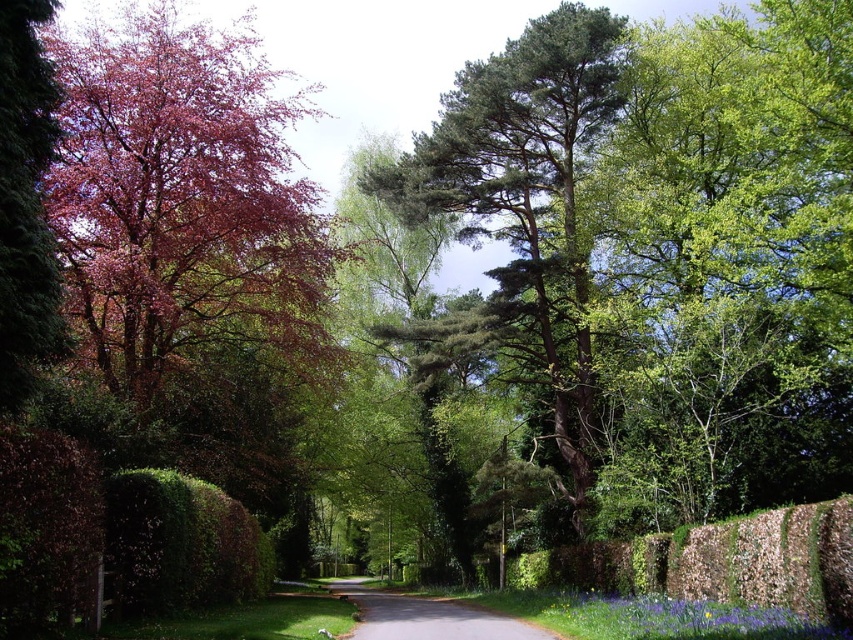
Who is more distant from viewer, (219, 588) or (476, 608)?

Positioned behind is point (476, 608).

Find the location of `green leafy hedge at lower left`. green leafy hedge at lower left is located at coordinates (178, 544).

You are a GUI agent. You are given a task and a screenshot of the screen. Output one action in this format:
    pyautogui.click(x=<x>, y=<y>)
    Task: Click on the green leafy hedge at lower left
    Image resolution: width=853 pixels, height=640 pixels.
    Given the screenshot: What is the action you would take?
    pyautogui.click(x=178, y=544)

Identify the location of green textured tree at center. (520, 212).

Does green textured tree at center appear over green leafy hedge at lower right?

Yes.

Identify the location of green textured tree at center. Image resolution: width=853 pixels, height=640 pixels. 520,212.

Between green leafy hedge at lower right and gray asphalt road at center, which one appears on the left side from the viewer's perspective?

From the viewer's perspective, gray asphalt road at center appears more on the left side.

Does point (670, 541) come behind point (538, 637)?

Yes, it is behind point (538, 637).

Locate an element on the screen. The image size is (853, 640). green leafy hedge at lower right is located at coordinates (720, 563).